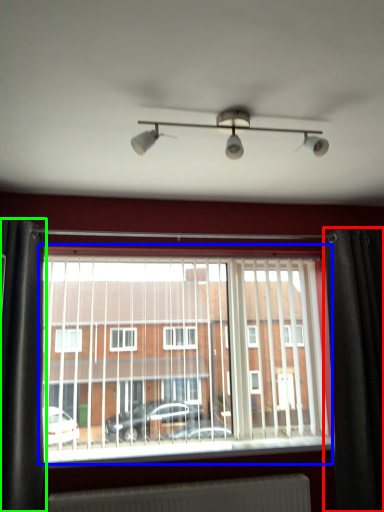
Question: Estimate the real-world distances between objects in this image. Which object is farther from curtain (highlighted by a red box), window (highlighted by a blue box) or curtain (highlighted by a green box)?

Choices:
 (A) window
 (B) curtain

Answer: (B)